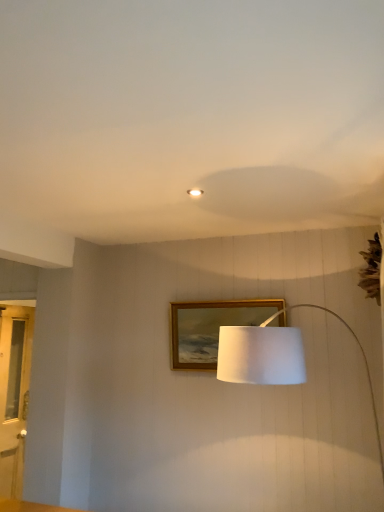
The height and width of the screenshot is (512, 384). Describe the element at coordinates (195, 192) in the screenshot. I see `matte white ceiling light at center` at that location.

Locate an element on the screen. The image size is (384, 512). white fabric lampshade at center is located at coordinates (274, 356).

Is point (19, 458) closer to camera compared to point (213, 336)?

That is False.

At what (x,y) coordinates should I click in order to perform the action: click on picture frame that is above the clear glass door at left (from the image's perspective). Please return your answer as a coordinate pair (x, y). This screenshot has width=384, height=512. Looking at the image, I should click on (211, 328).

Considering the relative sizes of clear glass door at left and gold wooden picture frame at center in the image provided, is clear glass door at left bigger than gold wooden picture frame at center?

Indeed, clear glass door at left has a larger size compared to gold wooden picture frame at center.

Considering the relative sizes of clear glass door at left and gold wooden picture frame at center in the image provided, is clear glass door at left shorter than gold wooden picture frame at center?

No, clear glass door at left is not shorter than gold wooden picture frame at center.

Are matte white ceiling light at center and white fabric lampshade at center making contact?

No, matte white ceiling light at center is not next to white fabric lampshade at center.

Considering the sizes of objects matte white ceiling light at center and white fabric lampshade at center in the image provided, who is thinner, matte white ceiling light at center or white fabric lampshade at center?

With smaller width is matte white ceiling light at center.

From a real-world perspective, is matte white ceiling light at center located higher than white fabric lampshade at center?

Yes, from a real-world perspective, matte white ceiling light at center is on top of white fabric lampshade at center.

You are a GUI agent. You are given a task and a screenshot of the screen. Output one action in this format:
    pyautogui.click(x=<x>, y=<y>)
    Task: Click on the lighting above the white fabric lampshade at center (from the image's perspective)
    The image size is (384, 512).
    Given the screenshot: What is the action you would take?
    pyautogui.click(x=195, y=192)

Between white fabric lampshade at center and matte white ceiling light at center, which one appears on the left side from the viewer's perspective?

matte white ceiling light at center is more to the left.

Does white fabric lampshade at center have a greater height compared to matte white ceiling light at center?

Yes, white fabric lampshade at center is taller than matte white ceiling light at center.

Is white fabric lampshade at center oriented towards matte white ceiling light at center?

No.

Between white fabric lampshade at center and clear glass door at left, which one has less height?

white fabric lampshade at center.

Consider the image. Does white fabric lampshade at center have a smaller size compared to clear glass door at left?

No, white fabric lampshade at center is not smaller than clear glass door at left.

Are white fabric lampshade at center and clear glass door at left located far from each other?

Yes, white fabric lampshade at center is far from clear glass door at left.

Is white fabric lampshade at center positioned with its back to clear glass door at left?

No, white fabric lampshade at center is not facing away from clear glass door at left.

Is matte white ceiling light at center to the right of gold wooden picture frame at center from the viewer's perspective?

Incorrect, matte white ceiling light at center is not on the right side of gold wooden picture frame at center.

Consider the image. Considering the sizes of objects matte white ceiling light at center and gold wooden picture frame at center in the image provided, who is wider, matte white ceiling light at center or gold wooden picture frame at center?

gold wooden picture frame at center.

Is point (195, 191) farther from camera compared to point (212, 330)?

No, (195, 191) is in front of (212, 330).

How different are the orientations of matte white ceiling light at center and gold wooden picture frame at center in degrees?

There is a 90-degree angle between the facing directions of matte white ceiling light at center and gold wooden picture frame at center.

Is gold wooden picture frame at center facing away from clear glass door at left?

That's not correct — gold wooden picture frame at center is not looking away from clear glass door at left.

From a real-world perspective, is gold wooden picture frame at center positioned above or below clear glass door at left?

From a real-world perspective, gold wooden picture frame at center is physically above clear glass door at left.

Is gold wooden picture frame at center far from clear glass door at left?

That's right, there is a large distance between gold wooden picture frame at center and clear glass door at left.

Is gold wooden picture frame at center wider or thinner than clear glass door at left?

In the image, gold wooden picture frame at center appears to be wider than clear glass door at left.

From a real-world perspective, is gold wooden picture frame at center over white fabric lampshade at center?

Yes, from a real-world perspective, gold wooden picture frame at center is on top of white fabric lampshade at center.

Does gold wooden picture frame at center have a larger size compared to white fabric lampshade at center?

Actually, gold wooden picture frame at center might be smaller than white fabric lampshade at center.

Is gold wooden picture frame at center positioned with its back to white fabric lampshade at center?

No, gold wooden picture frame at center is not facing the opposite direction of white fabric lampshade at center.

Locate an element on the screen. The width and height of the screenshot is (384, 512). glass door that is under the gold wooden picture frame at center (from a real-world perspective) is located at coordinates (14, 394).

The image size is (384, 512). In order to click on lighting on the left of the white fabric lampshade at center in this screenshot , I will do click(195, 192).

Looking at the image, which one is located further to clear glass door at left, gold wooden picture frame at center or white fabric lampshade at center?

white fabric lampshade at center is further to clear glass door at left.

When comparing their distances from white fabric lampshade at center, does gold wooden picture frame at center or matte white ceiling light at center seem closer?

matte white ceiling light at center is closer to white fabric lampshade at center.

Considering their positions, is white fabric lampshade at center positioned closer to gold wooden picture frame at center than clear glass door at left?

Based on the image, white fabric lampshade at center appears to be nearer to gold wooden picture frame at center.

From the image, which object appears to be farther from matte white ceiling light at center, white fabric lampshade at center or clear glass door at left?

clear glass door at left.

From the image, which object appears to be nearer to matte white ceiling light at center, gold wooden picture frame at center or white fabric lampshade at center?

white fabric lampshade at center is positioned closer to the anchor matte white ceiling light at center.

Estimate the real-world distances between objects in this image. Which object is closer to gold wooden picture frame at center, clear glass door at left or matte white ceiling light at center?

matte white ceiling light at center is closer to gold wooden picture frame at center.

Which object lies further to the anchor point matte white ceiling light at center, white fabric lampshade at center or gold wooden picture frame at center?

gold wooden picture frame at center lies further to matte white ceiling light at center than the other object.

Based on their spatial positions, is clear glass door at left or matte white ceiling light at center further from white fabric lampshade at center?

clear glass door at left.

What are the coordinates of `picture frame between matte white ceiling light at center and white fabric lampshade at center from top to bottom` in the screenshot? It's located at (211, 328).

In order to click on lighting between clear glass door at left and gold wooden picture frame at center in the horizontal direction in this screenshot , I will do `click(195, 192)`.

Find the location of a particular element. This screenshot has height=512, width=384. picture frame located between clear glass door at left and white fabric lampshade at center in the left-right direction is located at coordinates (211, 328).

Where is `lighting between clear glass door at left and white fabric lampshade at center in the horizontal direction`? lighting between clear glass door at left and white fabric lampshade at center in the horizontal direction is located at coordinates (195, 192).